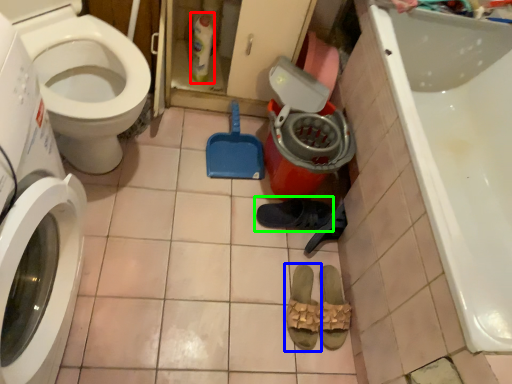
Question: Which object is positioned farthest from cleaning product (highlighted by a red box)? Select from footwear (highlighted by a blue box) and footwear (highlighted by a green box).

Choices:
 (A) footwear
 (B) footwear

Answer: (A)